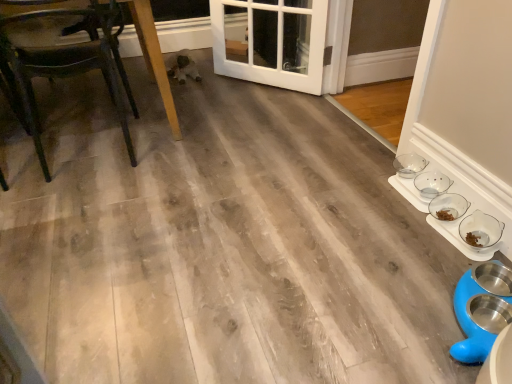
Question: Is clear glass bowls at lower right, which is counted as the 2th bowl, starting from the front, completely or partially inside clear glass bowls at right, which ranks as the third bowl in front-to-back order?

Choices:
 (A) yes
 (B) no

Answer: (B)

Question: Is clear glass bowls at right, which ranks as the third bowl in front-to-back order, bigger than clear glass bowls at lower right, which is counted as the 2th bowl, starting from the front?

Choices:
 (A) yes
 (B) no

Answer: (B)

Question: Considering the relative sizes of clear glass bowls at right, which ranks as the third bowl in front-to-back order, and clear glass bowls at lower right, which is counted as the 2th bowl, starting from the front, in the image provided, is clear glass bowls at right, which ranks as the third bowl in front-to-back order, thinner than clear glass bowls at lower right, which is counted as the 2th bowl, starting from the front,?

Choices:
 (A) no
 (B) yes

Answer: (B)

Question: Can you confirm if clear glass bowls at right, which is counted as the 1th bowl, starting from the back, is wider than clear glass bowls at lower right, which is counted as the 2th bowl, starting from the front?

Choices:
 (A) yes
 (B) no

Answer: (B)

Question: From a real-world perspective, is clear glass bowls at right, which is counted as the 1th bowl, starting from the back, located higher than clear glass bowls at lower right, which is counted as the 2th bowl, starting from the front?

Choices:
 (A) no
 (B) yes

Answer: (B)

Question: Does clear glass bowls at right, which ranks as the third bowl in front-to-back order, come in front of clear glass bowls at lower right, acting as the 2th bowl starting from the back?

Choices:
 (A) yes
 (B) no

Answer: (B)

Question: Is clear glass bowl at lower right, the 3th bowl in the back-to-front sequence, beside clear glass bowls at lower right, acting as the 2th bowl starting from the back?

Choices:
 (A) yes
 (B) no

Answer: (A)

Question: Is clear glass bowl at lower right, the 3th bowl in the back-to-front sequence, positioned behind clear glass bowls at lower right, acting as the 2th bowl starting from the back?

Choices:
 (A) no
 (B) yes

Answer: (A)

Question: Is clear glass bowl at lower right, which is the first bowl from front to back, to the right of clear glass bowls at lower right, acting as the 2th bowl starting from the back, from the viewer's perspective?

Choices:
 (A) no
 (B) yes

Answer: (B)

Question: From a real-world perspective, is clear glass bowl at lower right, which is the first bowl from front to back, beneath clear glass bowls at lower right, acting as the 2th bowl starting from the back?

Choices:
 (A) yes
 (B) no

Answer: (A)

Question: Can you confirm if clear glass bowl at lower right, the 3th bowl in the back-to-front sequence, is smaller than clear glass bowls at lower right, acting as the 2th bowl starting from the back?

Choices:
 (A) yes
 (B) no

Answer: (A)

Question: Is clear glass bowl at lower right, the 3th bowl in the back-to-front sequence, not close to clear glass bowls at lower right, which is counted as the 2th bowl, starting from the front?

Choices:
 (A) no
 (B) yes

Answer: (A)

Question: Considering the relative sizes of white glossy door at center and clear glass bowl at lower right, which is the first bowl from front to back, in the image provided, is white glossy door at center smaller than clear glass bowl at lower right, which is the first bowl from front to back,?

Choices:
 (A) yes
 (B) no

Answer: (B)